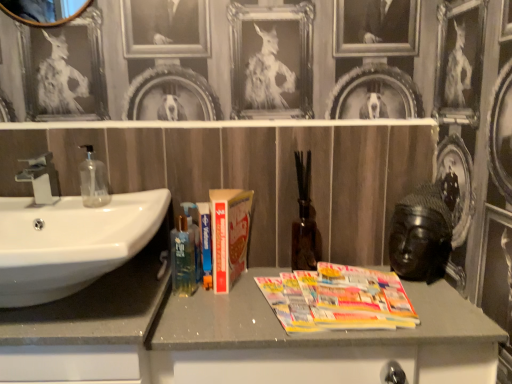
Where is `empty space that is in between transparent glass soap dispenser at left and matte silver faucet at left`? empty space that is in between transparent glass soap dispenser at left and matte silver faucet at left is located at coordinates (73, 204).